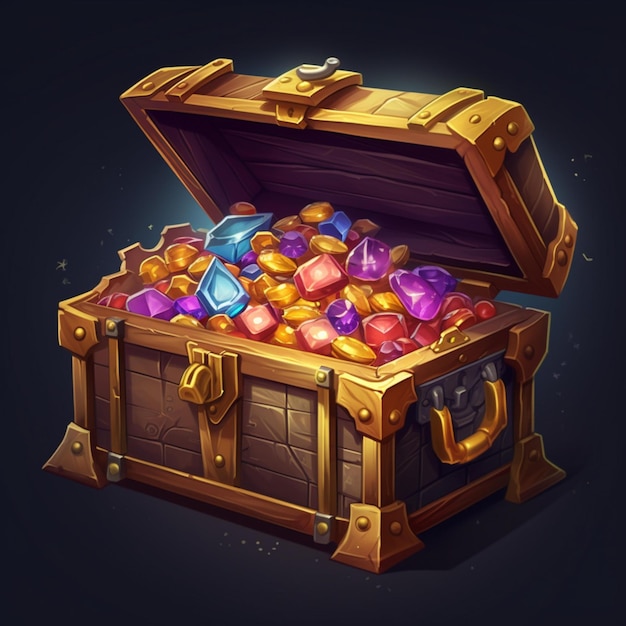
The image size is (626, 626). Identify the location of lock plate. (222, 429), (222, 406).